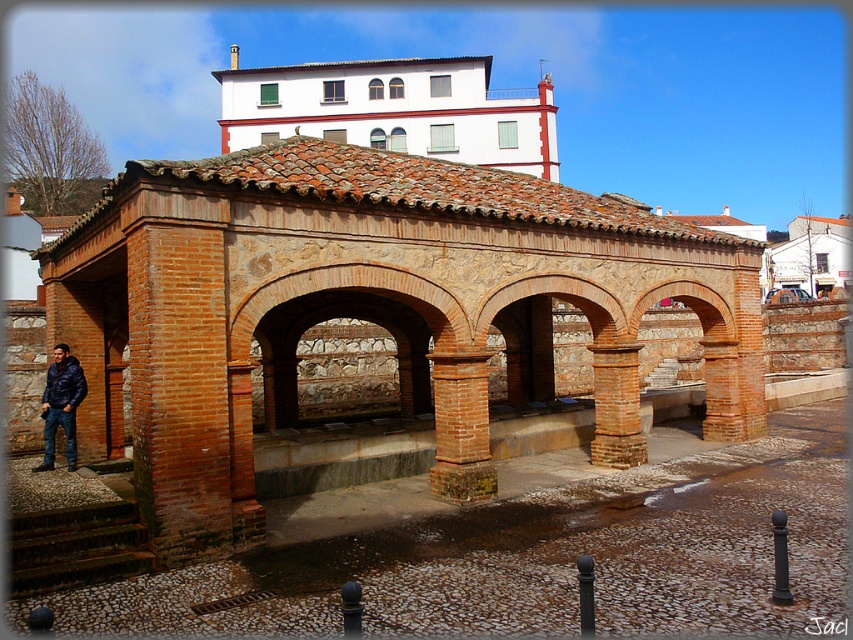
You are standing at the entrance of the historical brick structure and notice a brick column at center located at point (x=616, y=404). If you walk straight ahead, will you immediately encounter the brick column at center before reaching the central courtyard or passageway?

The brick column at center is located at point (x=616, y=404), which is positioned in front of the central courtyard or passageway. Therefore, walking straight ahead would first lead you to the brick column at center before reaching the courtyard or passageway.

You are an architect designing a scale model of this historical structure. You have two bricks from the scene to use as references. One is the brick at center and the other is the brick column at center. Which brick should you choose if you need a larger brick for your model?

The brick at center has a larger size compared to the brick column at center, so you should choose the brick at center for your model.

You are standing at the entrance of the historical brick structure and notice a specific point marked at coordinates point (461, 428). Based on the scene description, what material is located at that point?

The point (461, 428) is on brick at center, so the material at that point is brick.